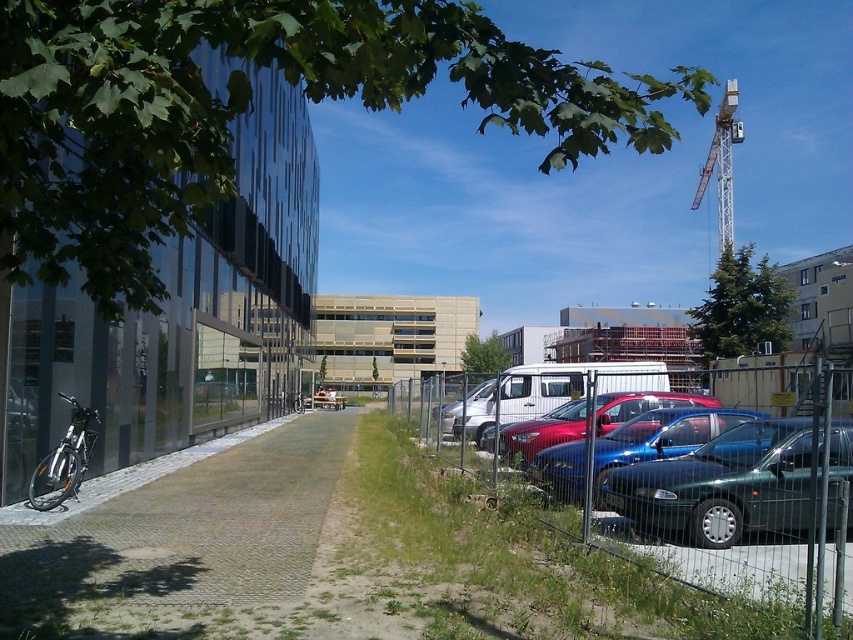
Is metallic blue sedan at right above silver metallic van at center?

Yes, metallic blue sedan at right is above silver metallic van at center.

Between point (654, 506) and point (444, 420), which one is positioned behind?

The point (444, 420) is more distant.

What are the coordinates of `metallic blue sedan at right` in the screenshot? It's located at (724, 484).

From the picture: Is white matte van at center in front of metallic white crane at upper right?

Yes, it is in front of metallic white crane at upper right.

Who is taller, white matte van at center or metallic white crane at upper right?

Standing taller between the two is metallic white crane at upper right.

Between point (511, 392) and point (730, 211), which one is positioned behind?

The point (730, 211) is behind.

The height and width of the screenshot is (640, 853). Identify the location of white matte van at center. pos(556,388).

Who is more forward, (608, 371) or (445, 413)?

Positioned in front is point (445, 413).

Between white matte van at center and silver metallic van at center, which one is positioned higher?

white matte van at center is higher up.

Between point (631, 368) and point (473, 394), which one is positioned in front?

Point (473, 394)

Locate an element on the screen. The width and height of the screenshot is (853, 640). white matte van at center is located at coordinates click(556, 388).